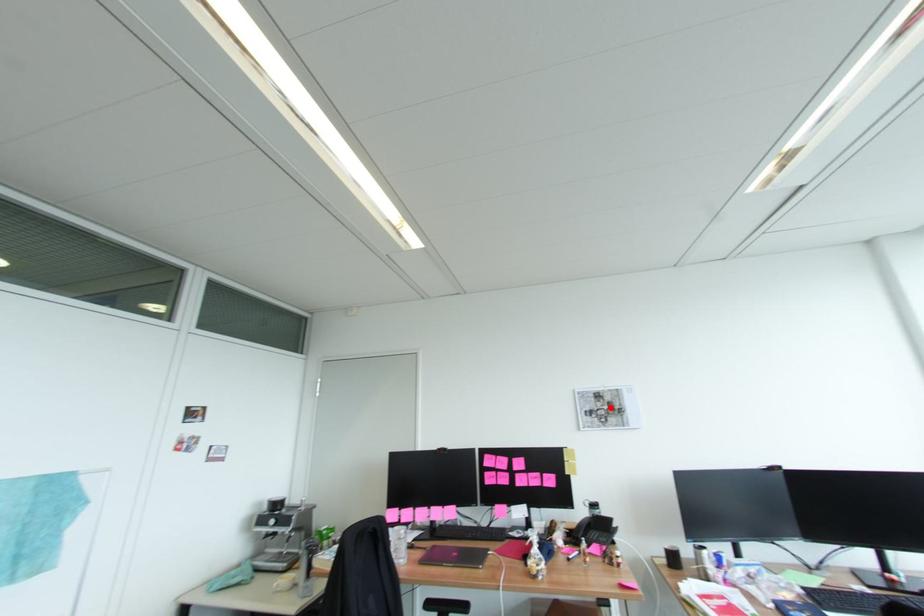
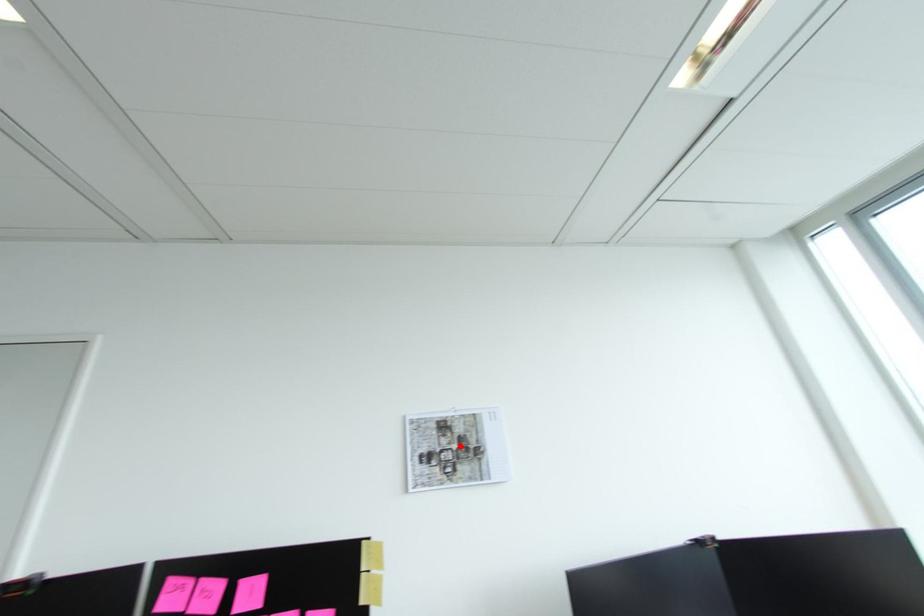
I am providing you with two images of the same scene from different viewpoints. A red point is marked on the first image and another point is marked on the second image. Are the points marked in image1 and image2 representing the same 3D position?

Yes